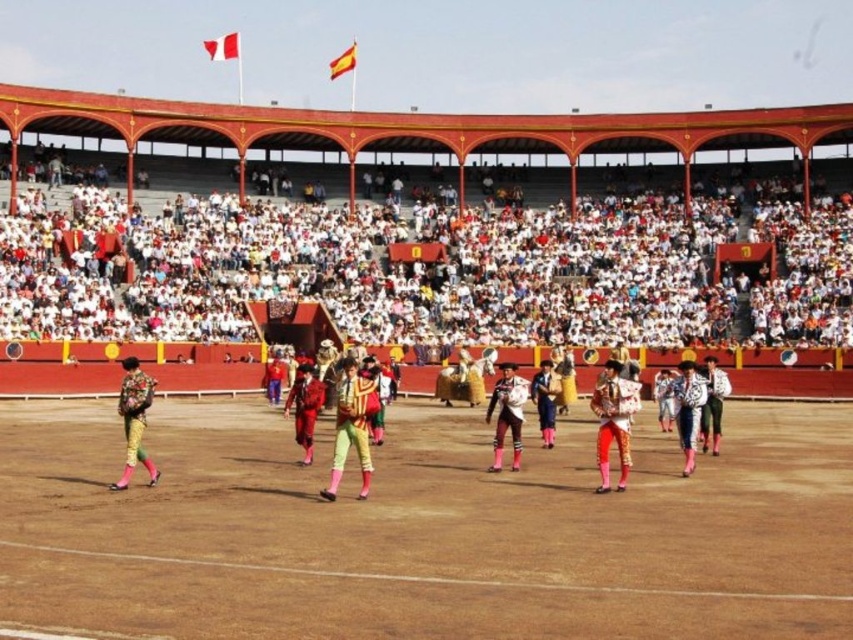
Question: Which object is farther from the camera taking this photo?

Choices:
 (A) shiny silver helmet at center
 (B) white satin jacket at center

Answer: (A)

Question: Which point is closer to the camera taking this photo?

Choices:
 (A) (238, 243)
 (B) (123, 404)
 (C) (520, 387)
 (D) (668, 422)

Answer: (B)

Question: Does white fabric crowd at upper center appear under floral fabric jacket at left?

Choices:
 (A) yes
 (B) no

Answer: (B)

Question: Which point appears closest to the camera in this image?

Choices:
 (A) (531, 394)
 (B) (312, 390)
 (C) (662, 289)

Answer: (B)

Question: Does white fabric crowd at upper center have a larger size compared to shiny silver helmet at center?

Choices:
 (A) no
 (B) yes

Answer: (B)

Question: Does shiny red pants at center appear on the left side of shiny silver helmet at center?

Choices:
 (A) yes
 (B) no

Answer: (A)